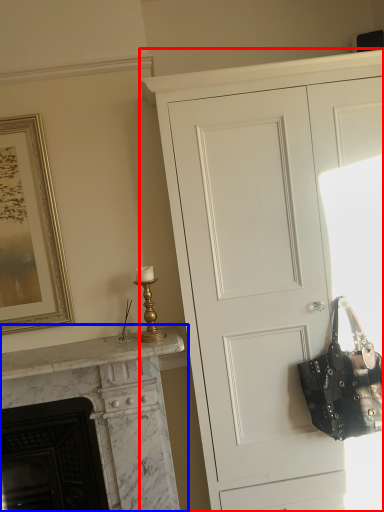
Question: Which point is closer to the camera, cupboard (highlighted by a red box) or fireplace (highlighted by a blue box)?

Choices:
 (A) cupboard
 (B) fireplace

Answer: (A)